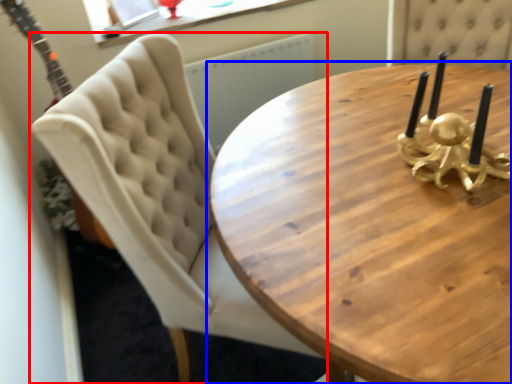
Question: Which object is closer to the camera taking this photo, chair (highlighted by a red box) or coffee table (highlighted by a blue box)?

Choices:
 (A) chair
 (B) coffee table

Answer: (B)